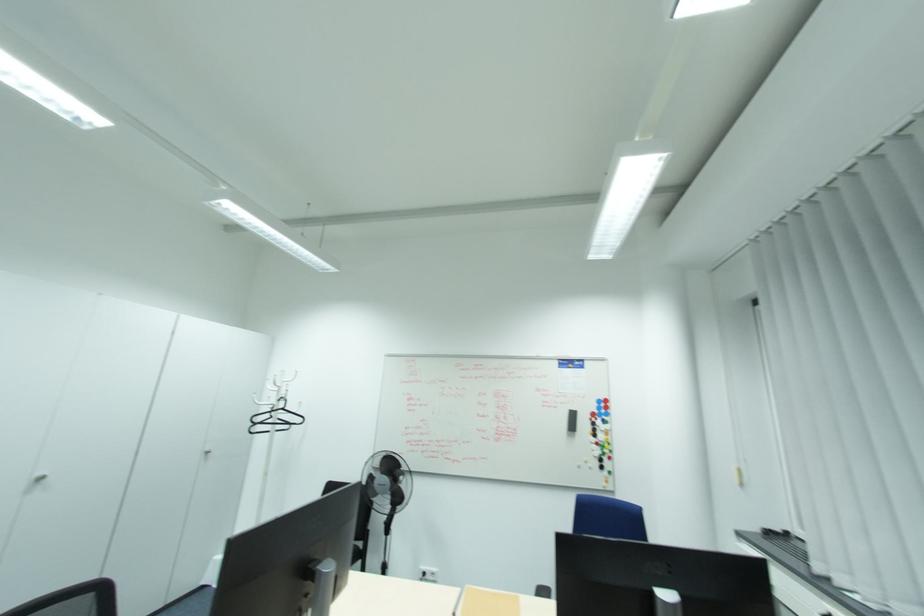
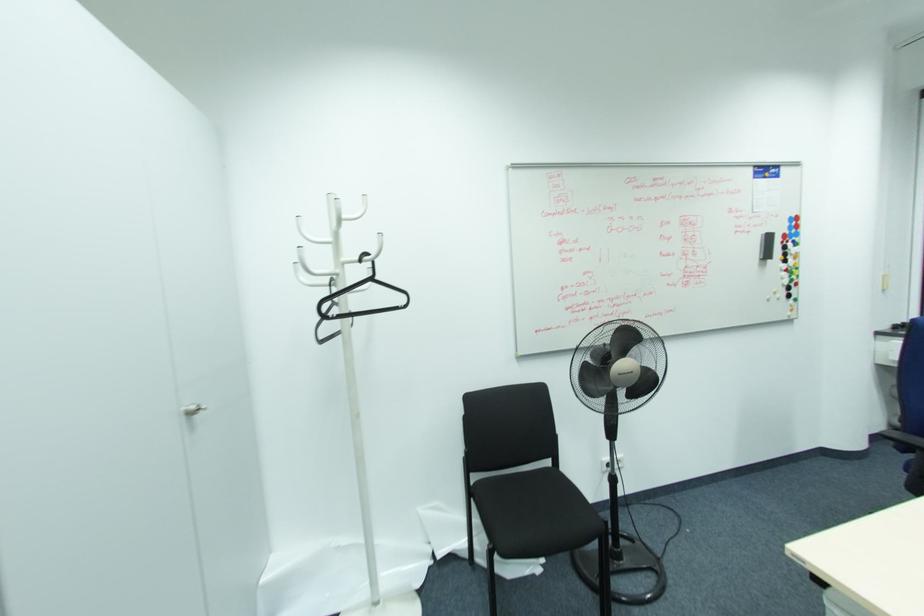
In the second image, find the point that corresponds to pixel 573 428 in the first image.

(768, 256)